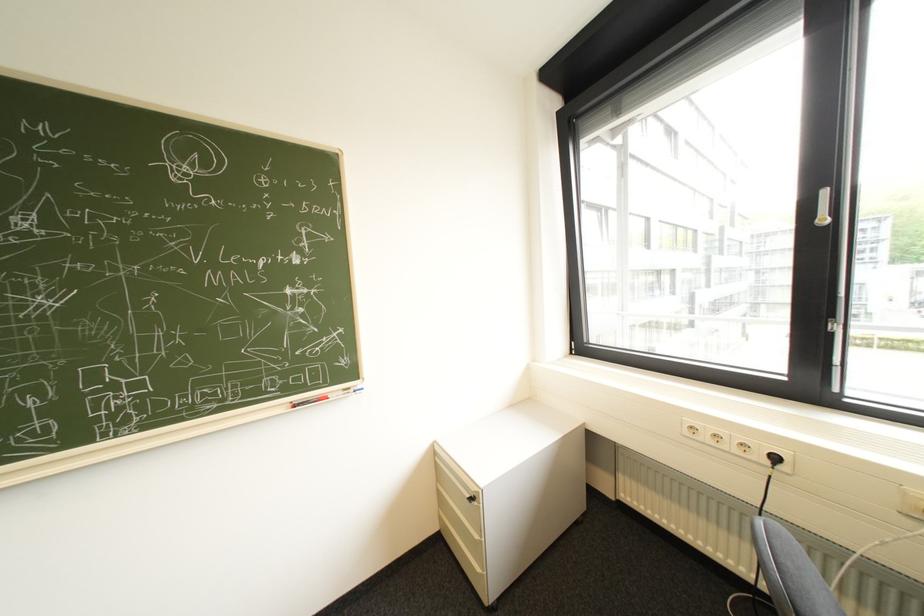
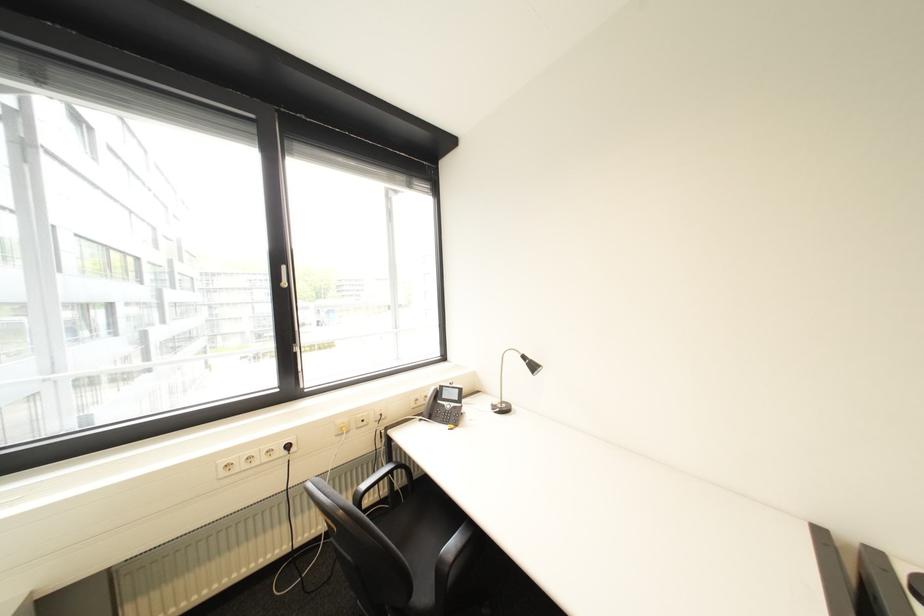
Question: The first image is from the beginning of the video and the second image is from the end. How did the camera likely rotate when shooting the video?

Choices:
 (A) Left
 (B) Right
 (C) Up
 (D) Down

Answer: (B)